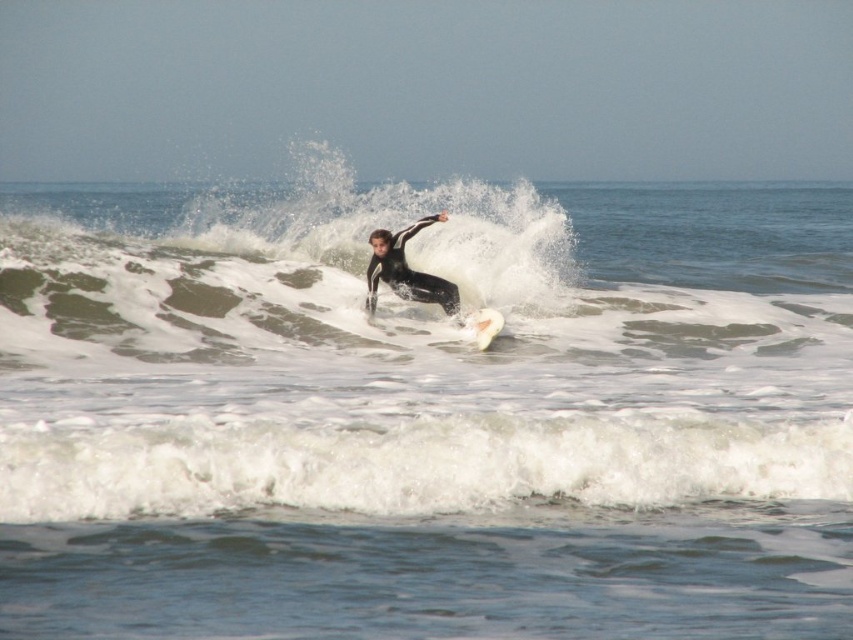
Question: Is black matte wetsuit at center smaller than white foam surfboard at center?

Choices:
 (A) yes
 (B) no

Answer: (B)

Question: Is white foamy water at center closer to camera compared to white foam surfboard at center?

Choices:
 (A) yes
 (B) no

Answer: (A)

Question: Which object is the closest to the white foamy water at center?

Choices:
 (A) white foamy wave at lower center
 (B) white foam surfboard at center

Answer: (B)

Question: Which object is positioned farthest from the black matte wetsuit at center?

Choices:
 (A) white foam surfboard at center
 (B) white foamy water at center
 (C) white foamy wave at lower center

Answer: (C)

Question: Does white foamy water at center appear over black matte wetsuit at center?

Choices:
 (A) no
 (B) yes

Answer: (B)

Question: Which of these objects is positioned closest to the white foam surfboard at center?

Choices:
 (A) black matte wetsuit at center
 (B) white foamy water at center
 (C) white foamy wave at lower center

Answer: (A)